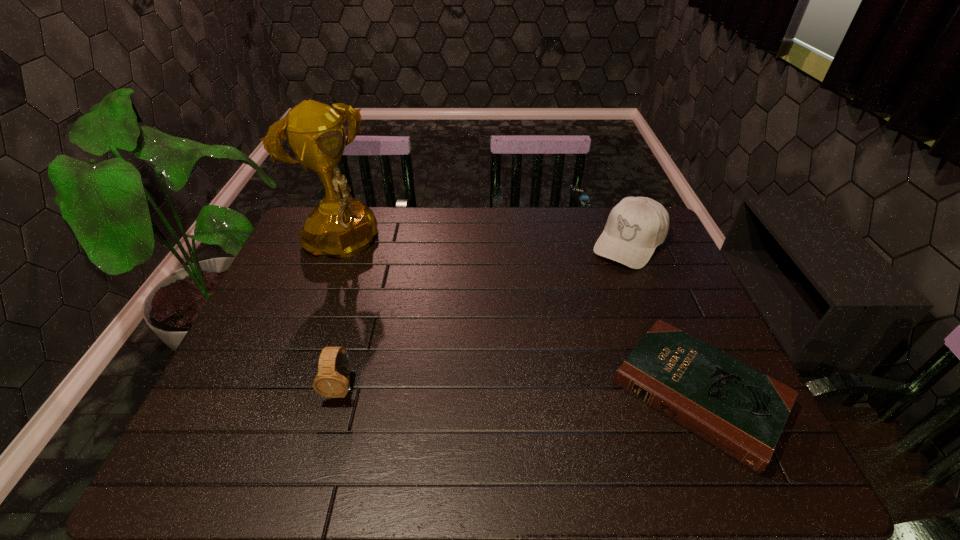
In order to click on object that is at the near right corner in this screenshot , I will do `click(737, 409)`.

Locate an element on the screen. This screenshot has width=960, height=540. vacant space at the far edge is located at coordinates (394, 238).

The image size is (960, 540). I want to click on vacant space at the near edge of the desktop, so click(x=324, y=419).

Identify the location of free space at the left edge. (260, 319).

This screenshot has width=960, height=540. In the image, there is a desktop. Find the location of `free space at the right edge`. free space at the right edge is located at coordinates (653, 271).

Locate an element on the screen. free space that is in between the baseball cap and the watch is located at coordinates (485, 315).

I want to click on free area in between the watch and the baseball cap, so click(x=485, y=315).

The image size is (960, 540). I want to click on empty location between the shortest object and the watch, so click(x=520, y=391).

Locate an element on the screen. The image size is (960, 540). vacant region between the baseball cap and the award is located at coordinates (484, 245).

Where is `vacant space that is in between the baseball cap and the watch`? This screenshot has height=540, width=960. vacant space that is in between the baseball cap and the watch is located at coordinates (485, 315).